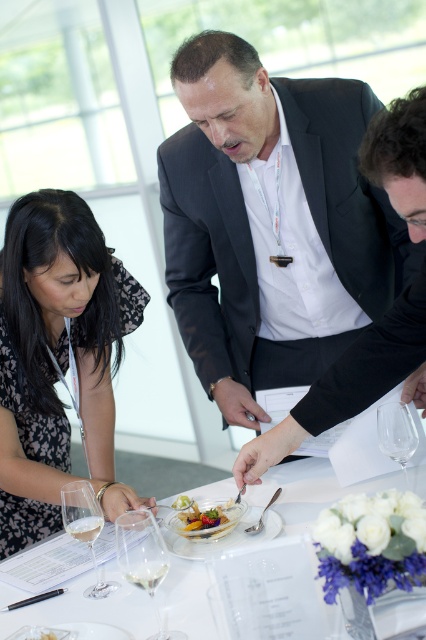
Question: In this image, where is clear glass wine at center located relative to clear glass at table center?

Choices:
 (A) below
 (B) above

Answer: (A)

Question: Which of these objects is positioned farthest from the white glossy plate at center?

Choices:
 (A) clear glass wine at lower center
 (B) clear glass wine at center

Answer: (A)

Question: Which object appears farthest from the camera in this image?

Choices:
 (A) clear glass wine at center
 (B) shiny glass plate at center
 (C) clear glass wine at lower center

Answer: (B)

Question: Which point is farther to the camera?

Choices:
 (A) black dotted dress at lower left
 (B) clear glass wine glass at center
 (C) clear glass wine glass at lower left

Answer: (A)

Question: Is the position of clear glass wine glass at center less distant than that of clear glass wine glass at lower left?

Choices:
 (A) no
 (B) yes

Answer: (B)

Question: Can you confirm if clear glass wine glass at center is positioned above translucent glass plate at center?

Choices:
 (A) no
 (B) yes

Answer: (B)